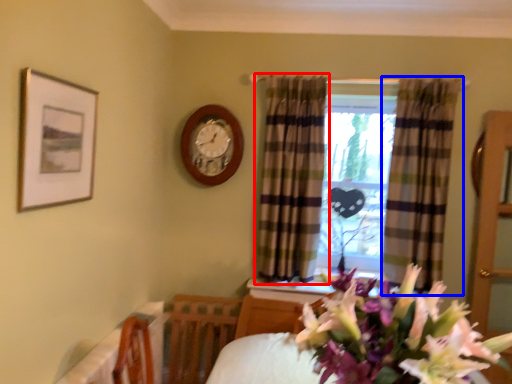
Question: Among these objects, which one is nearest to the camera, curtain (highlighted by a red box) or curtain (highlighted by a blue box)?

Choices:
 (A) curtain
 (B) curtain

Answer: (B)